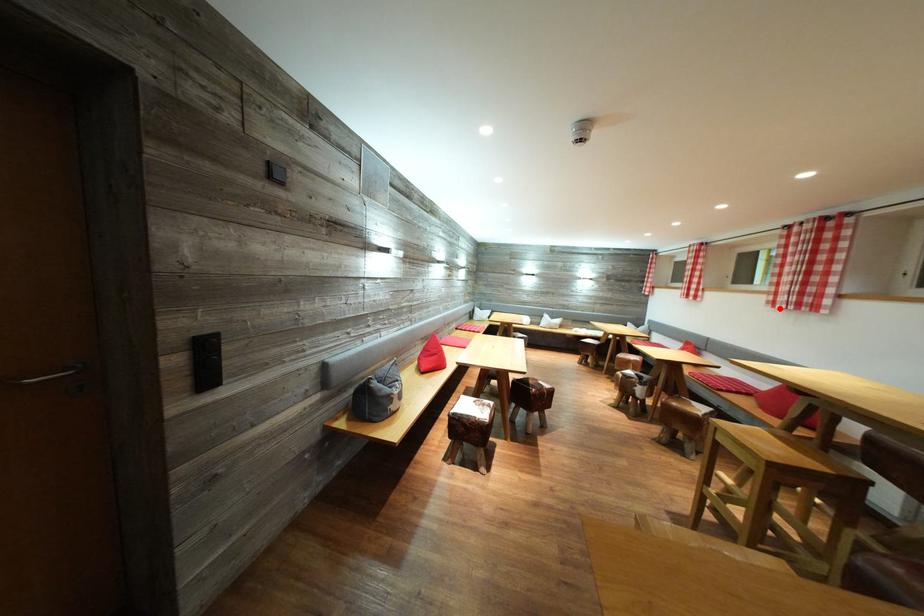
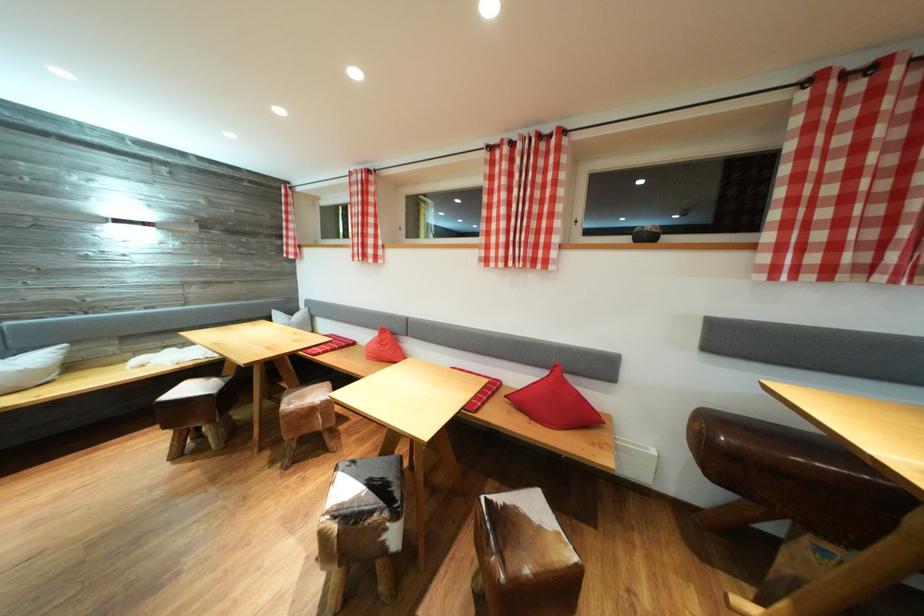
Locate, in the second image, the point that corresponds to the highlighted location in the first image.

(492, 265)